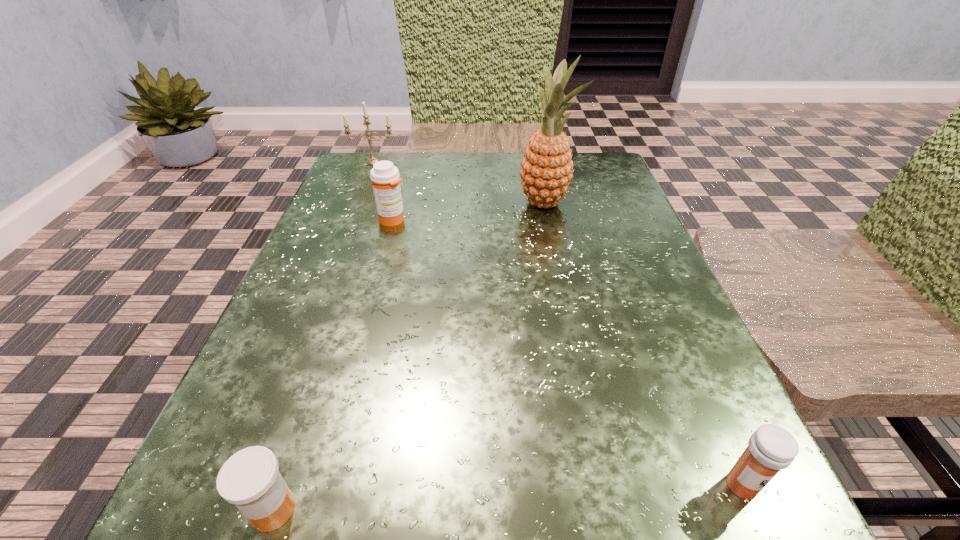
Identify which medicine is the nearest to the candle. Please provide its 2D coordinates. Your answer should be formatted as a tuple, i.e. [(x, y)], where the tuple contains the x and y coordinates of a point satisfying the conditions above.

[(385, 177)]

The image size is (960, 540). I want to click on medicine that is the closest to the rightmost object, so click(x=250, y=479).